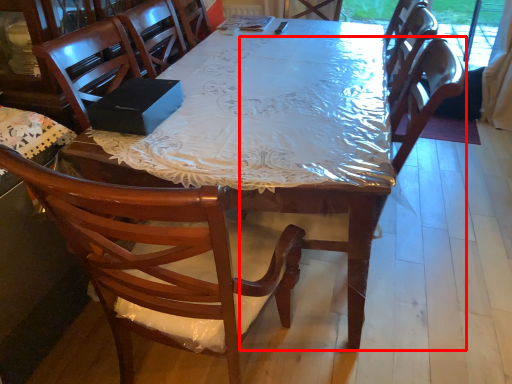
Question: From the image's perspective, what is the correct spatial positioning of armchair (annotated by the red box) in reference to desk?

Choices:
 (A) above
 (B) below

Answer: (B)